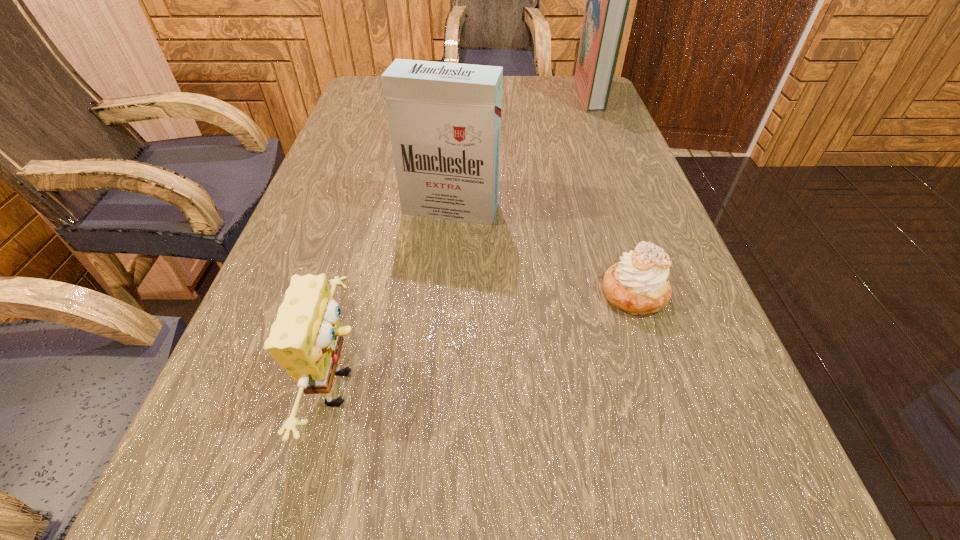
The image size is (960, 540). I want to click on free space at the left edge, so click(371, 137).

You are a GUI agent. You are given a task and a screenshot of the screen. Output one action in this format:
    pyautogui.click(x=<x>, y=<y>)
    Task: Click on the vacant region at the right edge of the desktop
    The width and height of the screenshot is (960, 540).
    Given the screenshot: What is the action you would take?
    pyautogui.click(x=601, y=146)

Identify the location of vacant space at the far left corner. (366, 78).

At what (x,y) coordinates should I click in order to perform the action: click on free space between the hardback book and the shortest object. Please return your answer as a coordinate pair (x, y). Image resolution: width=960 pixels, height=540 pixels. Looking at the image, I should click on (612, 193).

Identify the location of empty space between the cigarette case and the second shortest object. The height and width of the screenshot is (540, 960). (397, 298).

You are a GUI agent. You are given a task and a screenshot of the screen. Output one action in this format:
    pyautogui.click(x=<x>, y=<y>)
    Task: Click on the free spot between the second farthest object and the hardback book
    
    Given the screenshot: What is the action you would take?
    pyautogui.click(x=520, y=151)

Where is `free space between the second nearest object and the sponge`? This screenshot has height=540, width=960. free space between the second nearest object and the sponge is located at coordinates (489, 340).

At what (x,y) coordinates should I click in order to perform the action: click on vacant area that lies between the second nearest object and the farthest object. Please return your answer as a coordinate pair (x, y). The image size is (960, 540). Looking at the image, I should click on (612, 193).

Where is `vacant region between the second nearest object and the third nearest object`? The image size is (960, 540). vacant region between the second nearest object and the third nearest object is located at coordinates (542, 251).

Image resolution: width=960 pixels, height=540 pixels. Find the location of `vacant area that lies between the tallest object and the shortest object`. vacant area that lies between the tallest object and the shortest object is located at coordinates (612, 193).